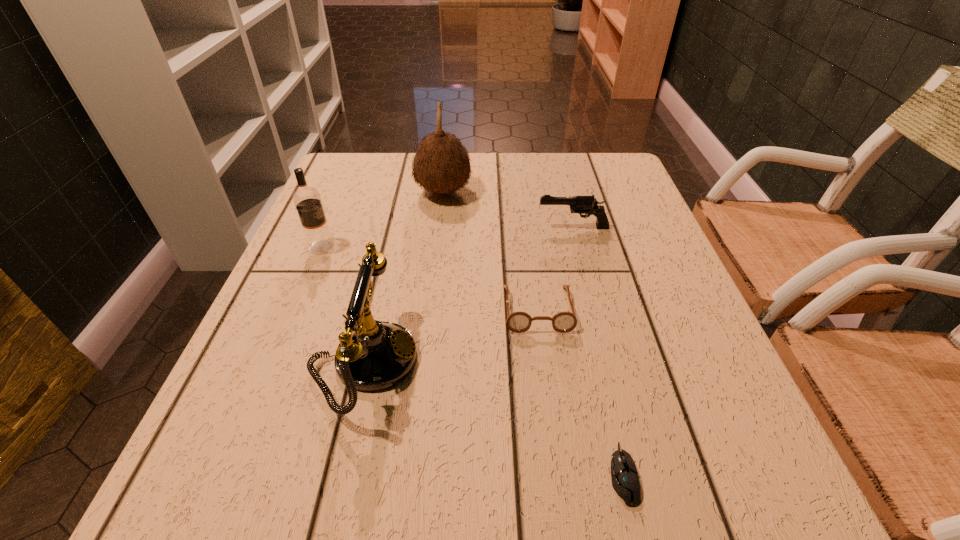
This screenshot has width=960, height=540. Find the location of `object that stands as the closest to the leftmost object`. object that stands as the closest to the leftmost object is located at coordinates (376, 355).

Identify the location of vacant area in the image that satisfies the following two spatial constraints: 1. on the front-facing side of the fifth tallest object; 2. on the dial of the telephone. pos(544,362).

Find the location of a particular element. This screenshot has width=960, height=540. free space that satisfies the following two spatial constraints: 1. on the surface of the farthest object; 2. on the back side of the computer mouse is located at coordinates click(x=413, y=474).

Locate an element on the screen. vacant area in the image that satisfies the following two spatial constraints: 1. on the label of the vodka; 2. on the left side of the computer mouse is located at coordinates (228, 474).

The width and height of the screenshot is (960, 540). What are the coordinates of `free spot that satisfies the following two spatial constraints: 1. on the label of the vodka; 2. on the right side of the shortest object` in the screenshot? It's located at (228, 474).